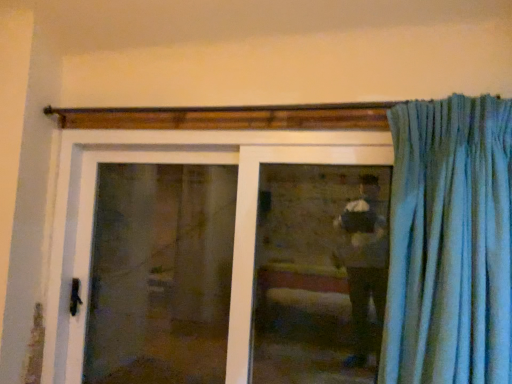
Question: From a real-world perspective, is clear glass window at center under transparent glass screen door at center?

Choices:
 (A) no
 (B) yes

Answer: (A)

Question: Is clear glass window at center placed right next to transparent glass screen door at center?

Choices:
 (A) yes
 (B) no

Answer: (B)

Question: Would you say clear glass window at center is outside transparent glass screen door at center?

Choices:
 (A) no
 (B) yes

Answer: (B)

Question: Is clear glass window at center to the right of transparent glass screen door at center from the viewer's perspective?

Choices:
 (A) yes
 (B) no

Answer: (A)

Question: Can you confirm if clear glass window at center is taller than transparent glass screen door at center?

Choices:
 (A) no
 (B) yes

Answer: (A)

Question: From the image's perspective, is clear glass window at center on top of transparent glass screen door at center?

Choices:
 (A) no
 (B) yes

Answer: (B)

Question: Is white plastic door at center bigger than clear glass window at center?

Choices:
 (A) yes
 (B) no

Answer: (A)

Question: From a real-world perspective, is white plastic door at center physically below clear glass window at center?

Choices:
 (A) no
 (B) yes

Answer: (B)

Question: From the image's perspective, is white plastic door at center above clear glass window at center?

Choices:
 (A) no
 (B) yes

Answer: (A)

Question: Does white plastic door at center have a lesser width compared to clear glass window at center?

Choices:
 (A) no
 (B) yes

Answer: (A)

Question: Is white plastic door at center positioned with its back to clear glass window at center?

Choices:
 (A) no
 (B) yes

Answer: (B)

Question: From a real-world perspective, is white plastic door at center positioned over clear glass window at center based on gravity?

Choices:
 (A) yes
 (B) no

Answer: (B)

Question: Is white plastic door at center closer to camera compared to transparent glass screen door at center?

Choices:
 (A) no
 (B) yes

Answer: (B)